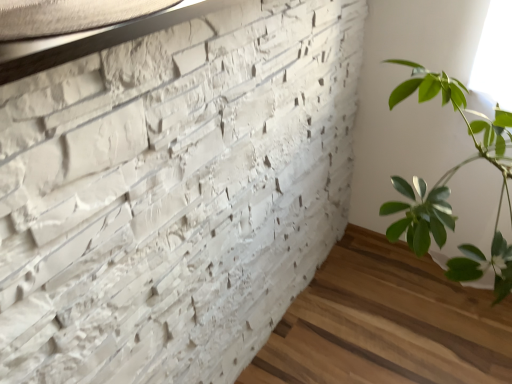
Question: In terms of height, does white textured brickwork at upper left look taller or shorter compared to matte white stone at upper left?

Choices:
 (A) short
 (B) tall

Answer: (B)

Question: Would you say white textured brickwork at upper left is to the left or to the right of matte white stone at upper left in the picture?

Choices:
 (A) right
 (B) left

Answer: (A)

Question: From a real-world perspective, is white textured brickwork at upper left positioned above or below matte white stone at upper left?

Choices:
 (A) above
 (B) below

Answer: (B)

Question: In terms of size, does matte white stone at upper left appear bigger or smaller than white textured brickwork at upper left?

Choices:
 (A) big
 (B) small

Answer: (B)

Question: From the image's perspective, is matte white stone at upper left located above or below white textured brickwork at upper left?

Choices:
 (A) below
 (B) above

Answer: (B)

Question: Is matte white stone at upper left situated inside white textured brickwork at upper left or outside?

Choices:
 (A) inside
 (B) outside

Answer: (A)

Question: Considering the positions of matte white stone at upper left and white textured brickwork at upper left in the image, is matte white stone at upper left taller or shorter than white textured brickwork at upper left?

Choices:
 (A) short
 (B) tall

Answer: (A)